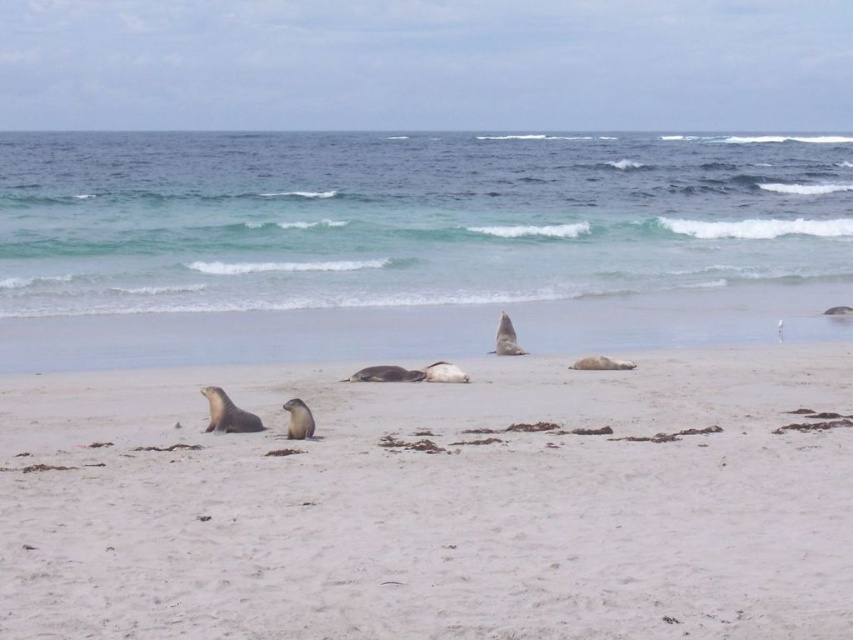
Question: Can you confirm if white sandy beach at center is positioned below blue-green water at upper center?

Choices:
 (A) no
 (B) yes

Answer: (B)

Question: Which of the following is the closest to the observer?

Choices:
 (A) click(x=389, y=150)
 (B) click(x=9, y=516)

Answer: (B)

Question: Can you confirm if white sandy beach at center is bigger than blue-green water at upper center?

Choices:
 (A) yes
 (B) no

Answer: (B)

Question: Which object is closer to the camera taking this photo?

Choices:
 (A) blue-green water at upper center
 (B) white sandy beach at center

Answer: (B)

Question: Can you confirm if white sandy beach at center is bigger than blue-green water at upper center?

Choices:
 (A) no
 (B) yes

Answer: (A)